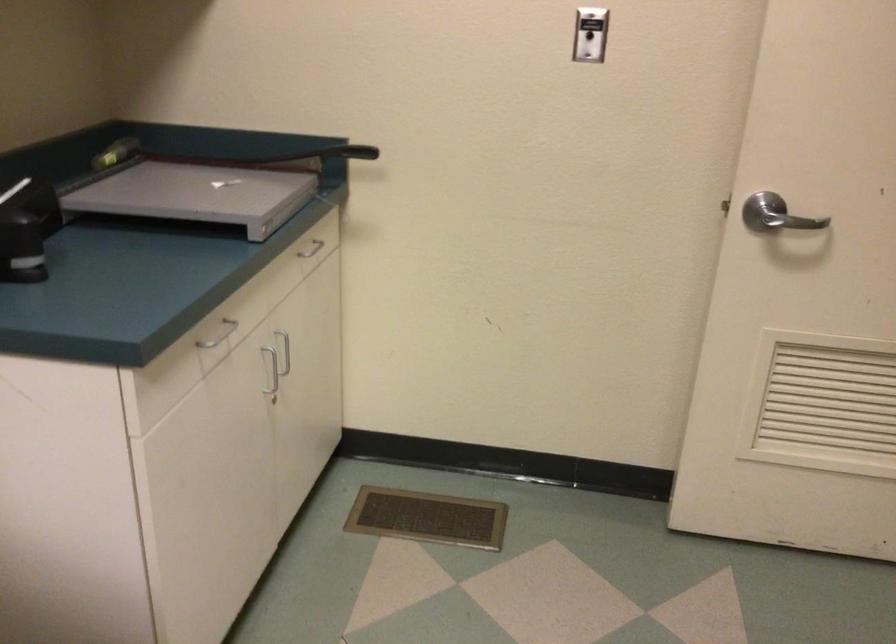
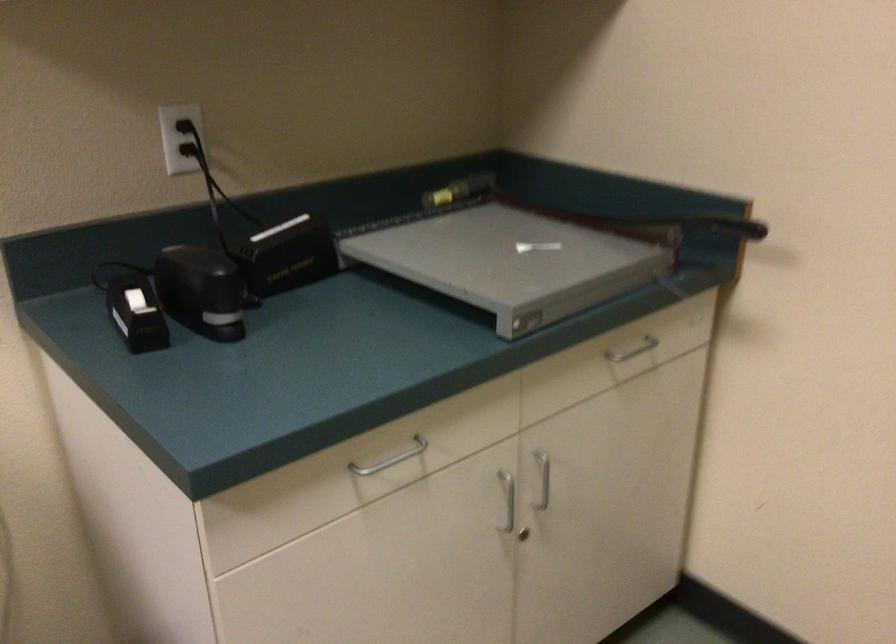
The point at (276,397) is marked in the first image. Where is the corresponding point in the second image?

(522, 534)